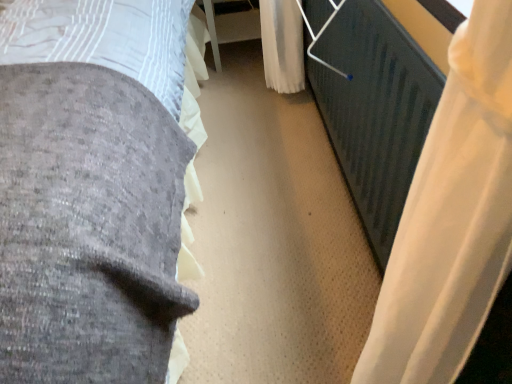
Question: Relative to velvet gray bed at left, is white plastic table at center in front or behind?

Choices:
 (A) behind
 (B) front

Answer: (A)

Question: Considering the positions of point (238, 36) and point (67, 51), is point (238, 36) closer or farther from the camera than point (67, 51)?

Choices:
 (A) closer
 (B) farther

Answer: (B)

Question: Which is farther from the white plastic table at center?

Choices:
 (A) velvet gray bed at left
 (B) white sheer curtain at right

Answer: (B)

Question: Estimate the real-world distances between objects in this image. Which object is closer to the white plastic table at center?

Choices:
 (A) velvet gray bed at left
 (B) white sheer curtain at right

Answer: (A)